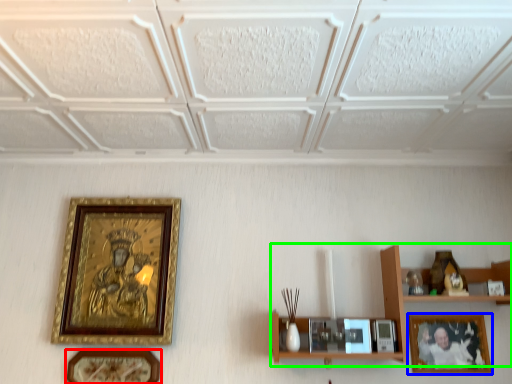
Question: Which object is the closest to the picture frame (highlighted by a red box)? Choose among these: picture frame (highlighted by a blue box) or shelf (highlighted by a green box).

Choices:
 (A) picture frame
 (B) shelf

Answer: (B)